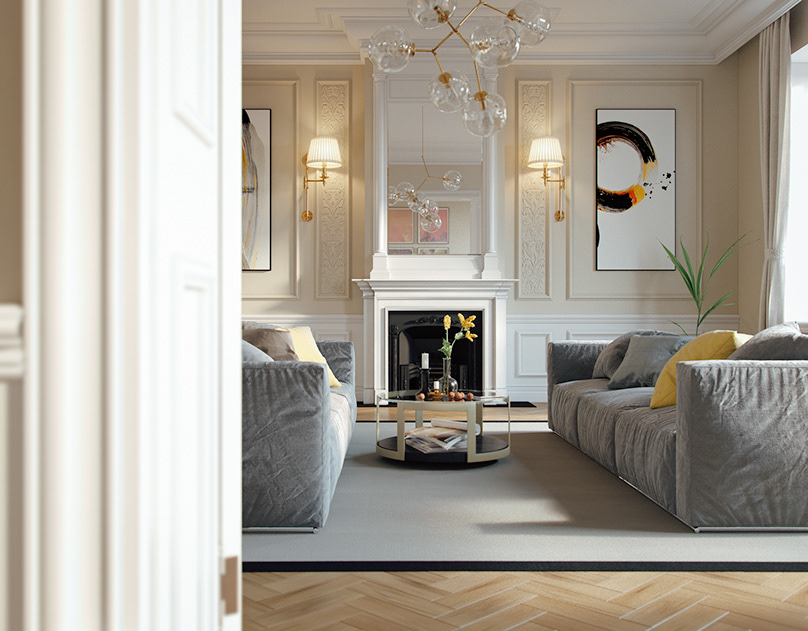
The width and height of the screenshot is (808, 631). I want to click on painting, so click(623, 227).